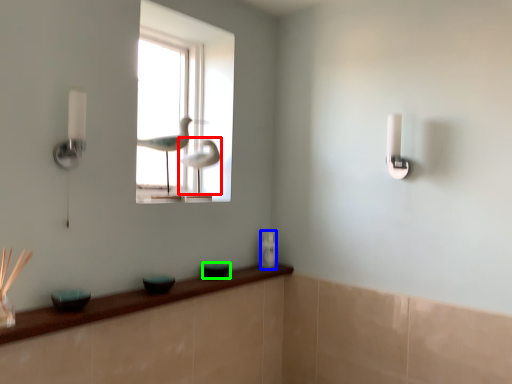
Question: Considering the real-world distances, which object is closest to bird (highlighted by a red box)? toiletry (highlighted by a blue box) or glass bowl (highlighted by a green box).

Choices:
 (A) toiletry
 (B) glass bowl

Answer: (A)